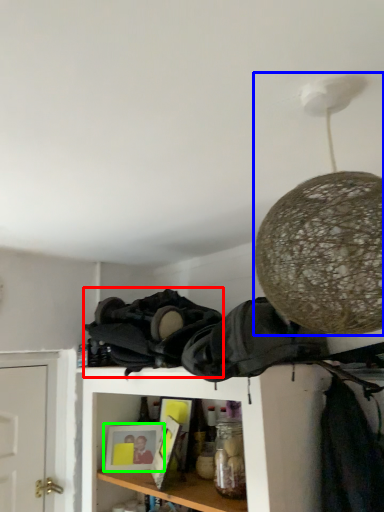
Question: Considering the real-world distances, which object is farthest from clothing (highlighted by a red box)? lamp (highlighted by a blue box) or picture frame (highlighted by a green box)?

Choices:
 (A) lamp
 (B) picture frame

Answer: (A)